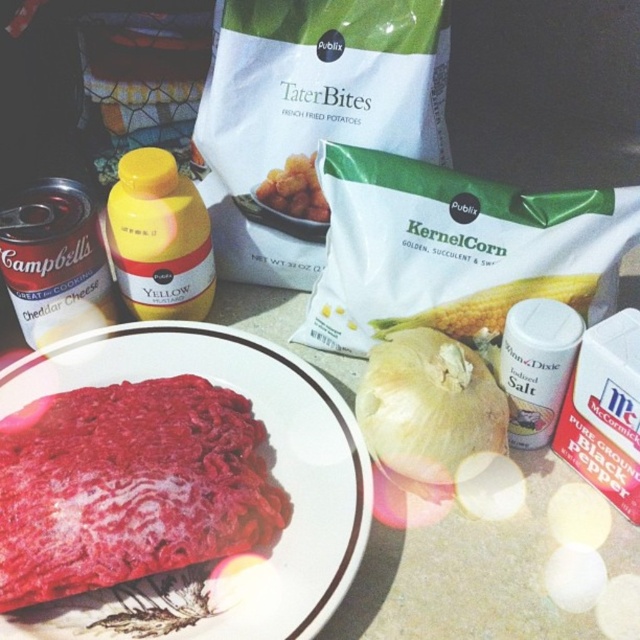
Question: Which is nearer to the smooth ceramic plate at center?

Choices:
 (A) yellow plastic bottle at center
 (B) golden crispy tater bites at center

Answer: (A)

Question: Which object is farther from the camera taking this photo?

Choices:
 (A) white matte onion at center
 (B) smooth ceramic plate at center
 (C) yellow plastic bottle at center

Answer: (C)

Question: Is white matte onion at center to the left of yellow plastic bottle at center from the viewer's perspective?

Choices:
 (A) yes
 (B) no

Answer: (B)

Question: Based on their relative distances, which object is nearer to the yellow plastic bottle at center?

Choices:
 (A) smooth ceramic plate at center
 (B) white matte corn at center
 (C) white matte onion at center

Answer: (A)

Question: Is smooth ceramic plate at center bigger than yellow plastic bottle at center?

Choices:
 (A) yes
 (B) no

Answer: (A)

Question: Is white matte onion at center positioned behind yellow plastic bottle at center?

Choices:
 (A) yes
 (B) no

Answer: (B)